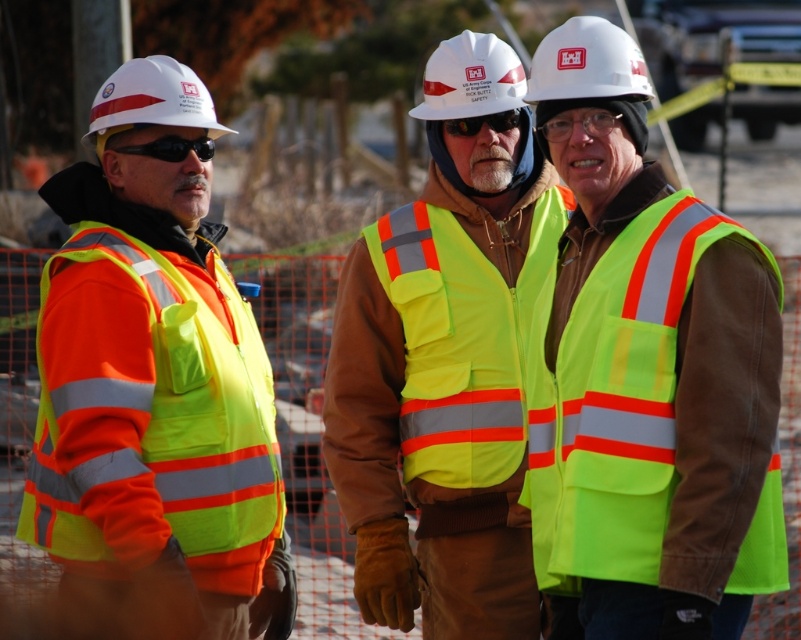
Question: Can you confirm if neon yellow reflective vest at center is positioned above high-visibility fabric safety vest at center?

Choices:
 (A) yes
 (B) no

Answer: (B)

Question: Among these objects, which one is farthest from the camera?

Choices:
 (A) high-visibility fabric safety vest at center
 (B) white hard hat at center
 (C) neon yellow reflective vest at center
 (D) high-visibility reflective vest at center

Answer: (A)

Question: Does high-visibility fabric safety vest at center appear over white hard hat at center?

Choices:
 (A) yes
 (B) no

Answer: (B)

Question: Which of the following is the closest to the observer?

Choices:
 (A) (254, 493)
 (B) (465, 380)
 (C) (457, 298)
 (D) (739, 428)

Answer: (D)

Question: Which point is closer to the camera?

Choices:
 (A) neon yellow reflective vest at center
 (B) high-visibility fabric safety vest at center
 (C) high-visibility fabric safety vest at left

Answer: (A)

Question: Does high-visibility reflective vest at center have a smaller size compared to high-visibility fabric safety vest at center?

Choices:
 (A) no
 (B) yes

Answer: (A)